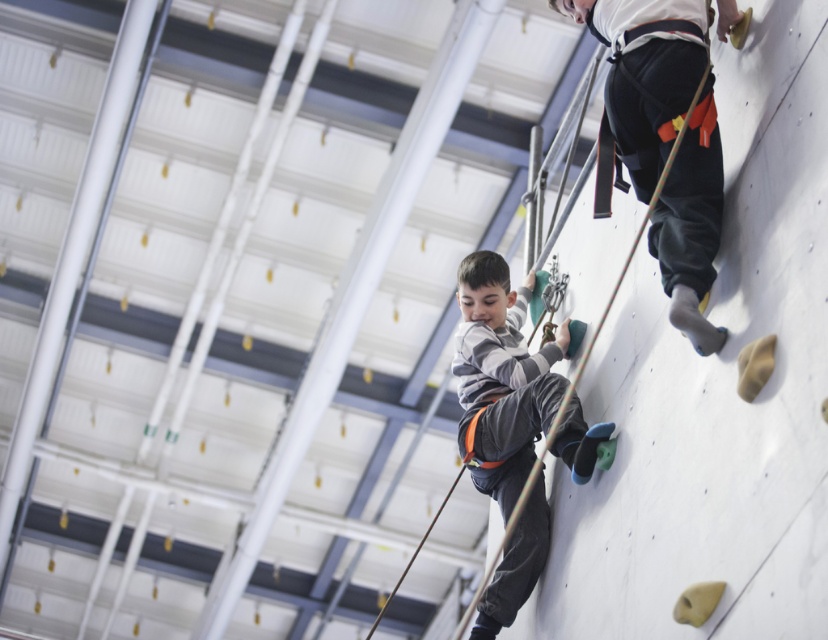
Question: Is black fabric pants at upper right wider than gray fabric pants at center?

Choices:
 (A) no
 (B) yes

Answer: (B)

Question: Which point is closer to the camera?

Choices:
 (A) gray fabric pants at center
 (B) black fabric pants at upper right

Answer: (B)

Question: Does black fabric pants at upper right appear over gray fabric pants at center?

Choices:
 (A) yes
 (B) no

Answer: (A)

Question: Is black fabric pants at upper right to the right of gray fabric pants at center from the viewer's perspective?

Choices:
 (A) yes
 (B) no

Answer: (A)

Question: Which object is farther from the camera taking this photo?

Choices:
 (A) gray fabric pants at center
 (B) black fabric pants at upper right

Answer: (A)